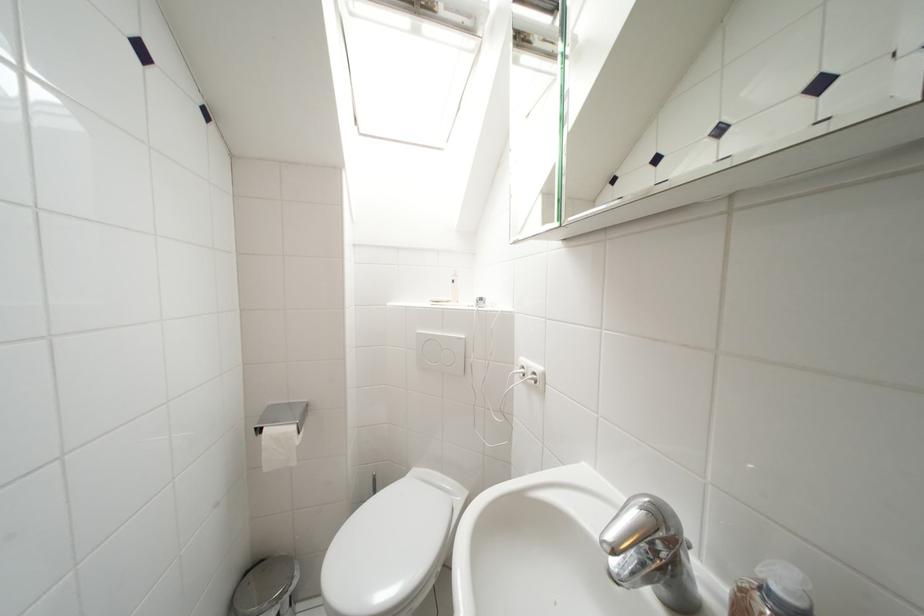
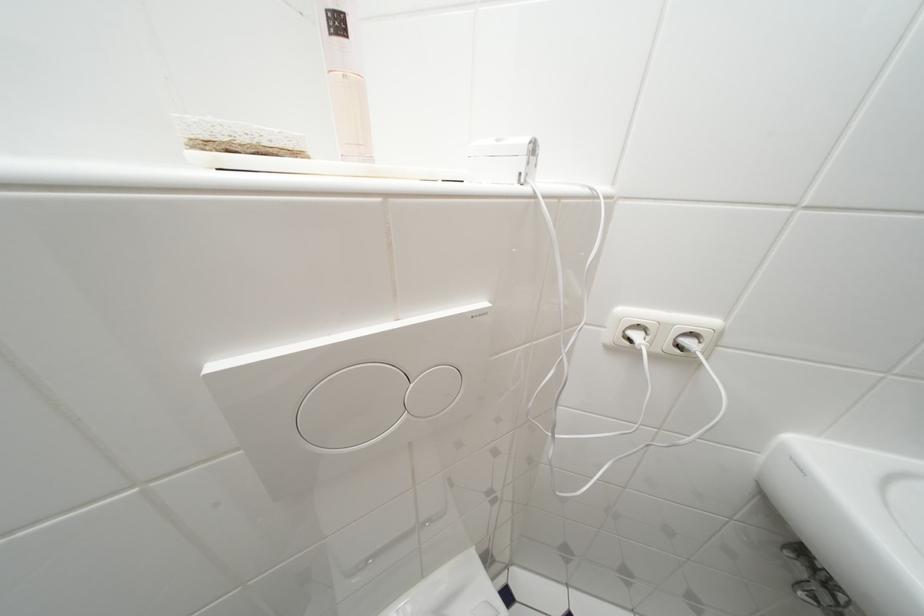
Where in the second image is the point corresponding to (459,285) from the first image?

(345, 26)